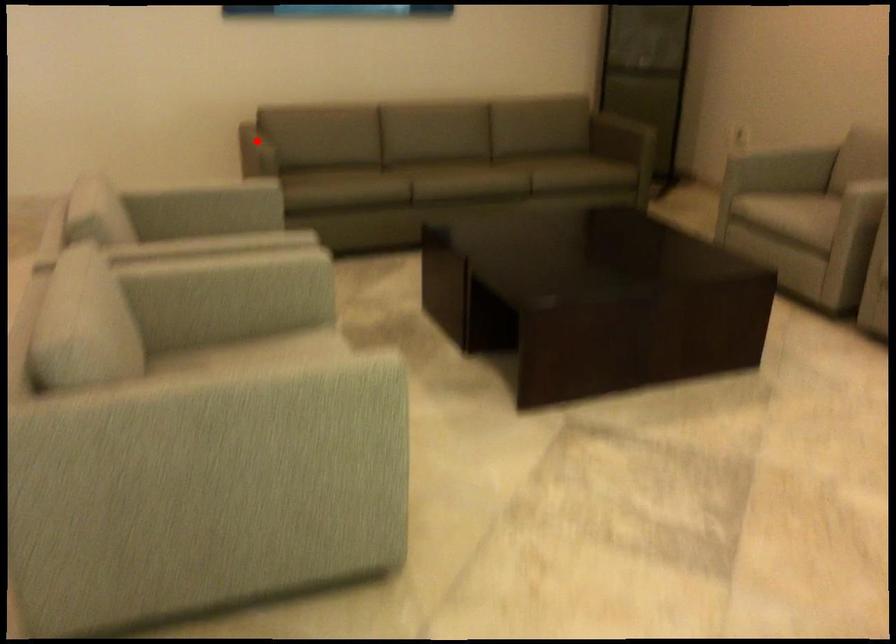
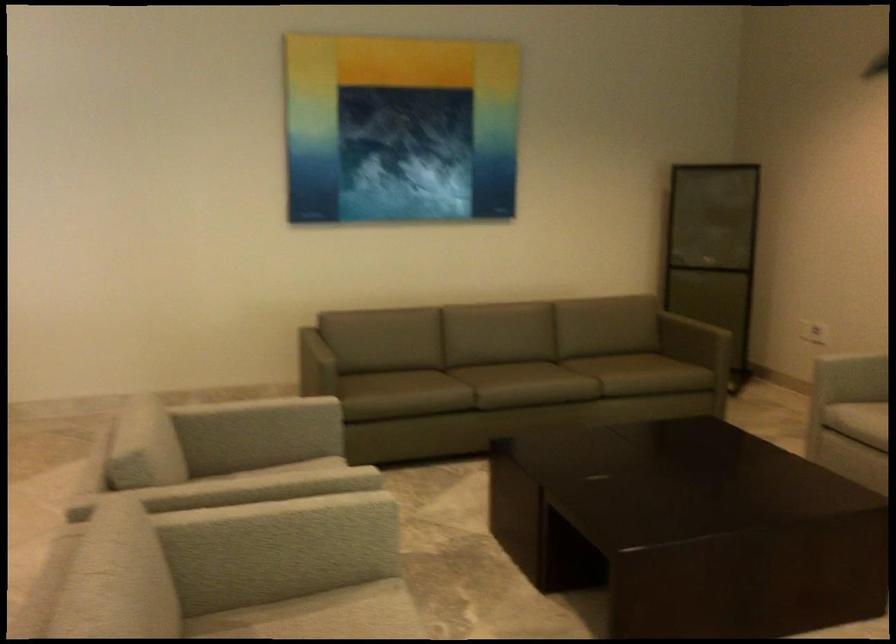
The point at the highlighted location is marked in the first image. Where is the corresponding point in the second image?

(316, 345)